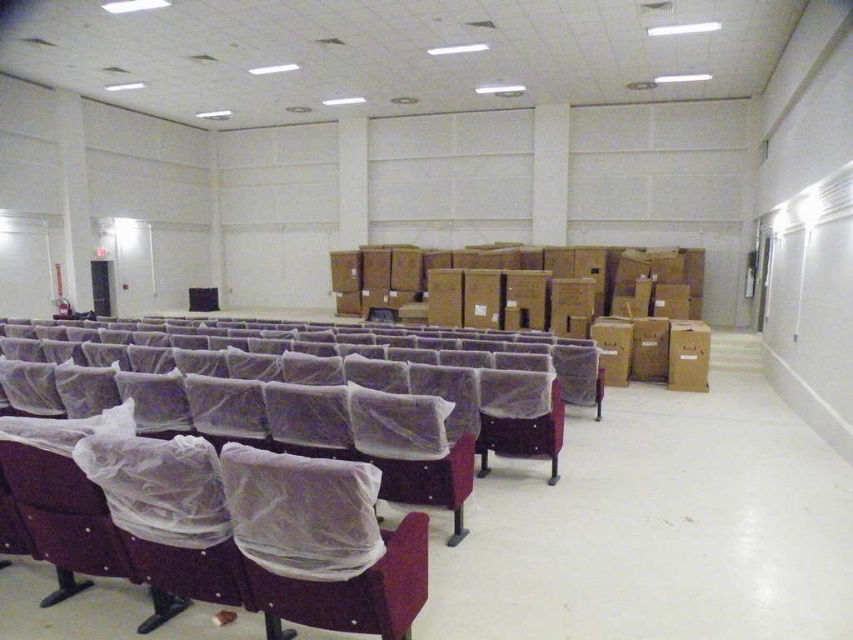
Question: Which of the following is the closest to the observer?

Choices:
 (A) matte plastic chair at center
 (B) clear plastic chair at center

Answer: (A)

Question: Which object appears farthest from the camera in this image?

Choices:
 (A) clear plastic chair at center
 (B) matte purple chair at left

Answer: (B)

Question: Is matte purple chair at left above matte plastic chair at center?

Choices:
 (A) no
 (B) yes

Answer: (B)

Question: Which of the following is the farthest from the observer?

Choices:
 (A) (393, 477)
 (B) (291, 589)

Answer: (A)

Question: In this image, where is matte purple chair at left located relative to clear plastic chair at center?

Choices:
 (A) above
 (B) below

Answer: (A)

Question: Is matte purple chair at left closer to the viewer compared to clear plastic chair at center?

Choices:
 (A) no
 (B) yes

Answer: (A)